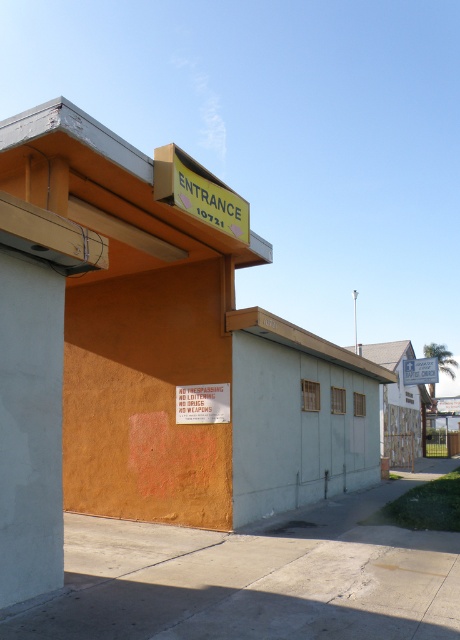
Question: In this image, where is yellow matte sign at upper center located relative to white plastic sign at center?

Choices:
 (A) left
 (B) right

Answer: (A)

Question: Among these objects, which one is nearest to the camera?

Choices:
 (A) yellow matte sign at upper center
 (B) white plastic sign at center
 (C) white concrete pillar at left

Answer: (C)

Question: Which of these objects is positioned farthest from the white concrete pillar at left?

Choices:
 (A) yellow matte sign at upper center
 (B) white plastic sign at center

Answer: (B)

Question: Considering the real-world distances, which object is closest to the yellow matte sign at upper center?

Choices:
 (A) white concrete pillar at left
 (B) white plastic sign at center

Answer: (A)

Question: Can you confirm if white concrete pillar at left is smaller than white plastic sign at center?

Choices:
 (A) no
 (B) yes

Answer: (B)

Question: From the image, what is the correct spatial relationship of white concrete pillar at left in relation to yellow matte sign at upper center?

Choices:
 (A) above
 (B) below

Answer: (B)